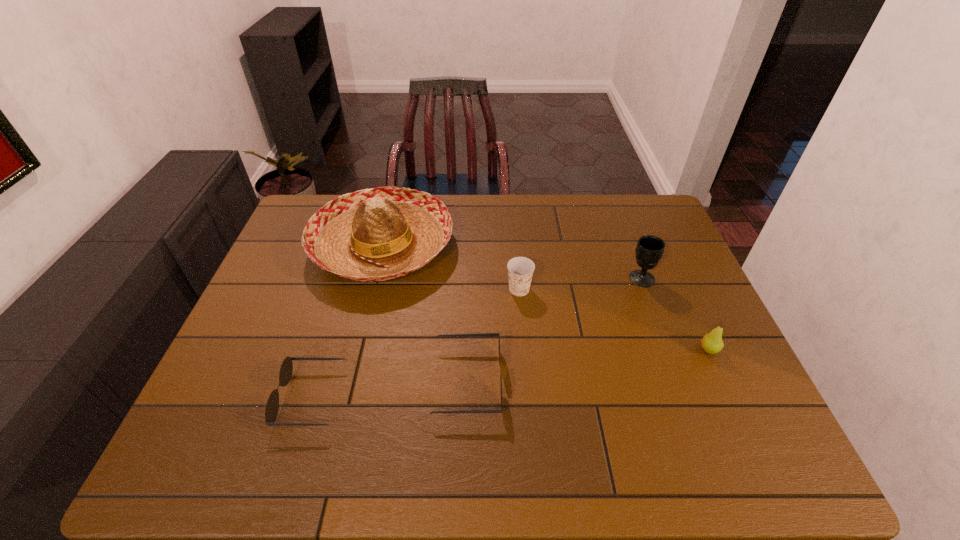
Locate an element on the screen. The width and height of the screenshot is (960, 540). blank area located 0.230m on the front-facing side of the taller sunglasses is located at coordinates (597, 381).

What are the coordinates of `vacant space situated 0.340m on the front of the tallest object` in the screenshot? It's located at tap(343, 406).

This screenshot has height=540, width=960. What are the coordinates of `free space located on the back of the second object from right to left` in the screenshot? It's located at (626, 239).

Locate an element on the screen. The image size is (960, 540). free space located 0.170m on the left of the rightmost object is located at coordinates (633, 349).

The width and height of the screenshot is (960, 540). What are the coordinates of `free space located on the left of the Dixie cup` in the screenshot? It's located at (378, 289).

Identify the location of object located in the far edge section of the desktop. [370, 235].

You are a GUI agent. You are given a task and a screenshot of the screen. Output one action in this format:
    pyautogui.click(x=<x>, y=<y>)
    Task: Click on the object at the left edge
    The width and height of the screenshot is (960, 540).
    Given the screenshot: What is the action you would take?
    pyautogui.click(x=370, y=235)

Identify the location of chalice that is at the right edge. The image size is (960, 540). (649, 250).

At what (x,y) coordinates should I click in order to perform the action: click on pear that is at the right edge. Please return your answer as a coordinate pair (x, y). This screenshot has width=960, height=540. Looking at the image, I should click on (712, 343).

Identify the location of object situated at the far left corner. The height and width of the screenshot is (540, 960). (370, 235).